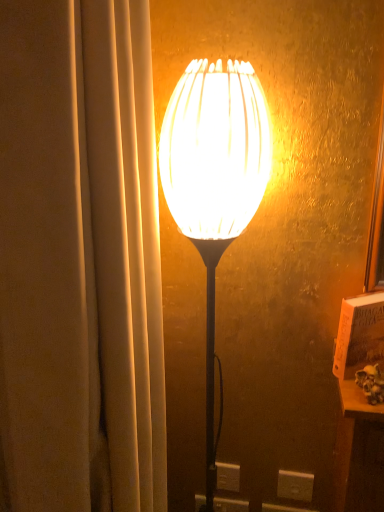
Question: Is white plastic electric outlet at lower center oriented towards white matte lampshade at center?

Choices:
 (A) no
 (B) yes

Answer: (A)

Question: Can you confirm if white plastic electric outlet at lower center is wider than white matte lampshade at center?

Choices:
 (A) yes
 (B) no

Answer: (B)

Question: From a real-world perspective, does white plastic electric outlet at lower center sit lower than white matte lampshade at center?

Choices:
 (A) yes
 (B) no

Answer: (A)

Question: Is white plastic electric outlet at lower center smaller than white matte lampshade at center?

Choices:
 (A) yes
 (B) no

Answer: (A)

Question: Is white plastic electric outlet at lower center taller than white matte lampshade at center?

Choices:
 (A) no
 (B) yes

Answer: (A)

Question: From a real-world perspective, is white plastic electric outlet at lower center located higher than white matte lampshade at center?

Choices:
 (A) yes
 (B) no

Answer: (B)

Question: Is white matte lampshade at center turned away from white plastic electric outlet at lower center?

Choices:
 (A) yes
 (B) no

Answer: (B)

Question: From a real-world perspective, is white matte lampshade at center below white plastic electric outlet at lower center?

Choices:
 (A) yes
 (B) no

Answer: (B)

Question: Is white plastic electric outlet at lower center inside white matte lampshade at center?

Choices:
 (A) yes
 (B) no

Answer: (B)

Question: From the image's perspective, is white matte lampshade at center located beneath white plastic electric outlet at lower center?

Choices:
 (A) yes
 (B) no

Answer: (B)

Question: Is white matte lampshade at center bigger than white plastic electric outlet at lower center?

Choices:
 (A) yes
 (B) no

Answer: (A)

Question: Does white matte lampshade at center turn towards white plastic electric outlet at lower center?

Choices:
 (A) yes
 (B) no

Answer: (B)

Question: From their relative heights in the image, would you say white plastic electric outlet at lower center is taller or shorter than white matte lampshade at center?

Choices:
 (A) short
 (B) tall

Answer: (A)